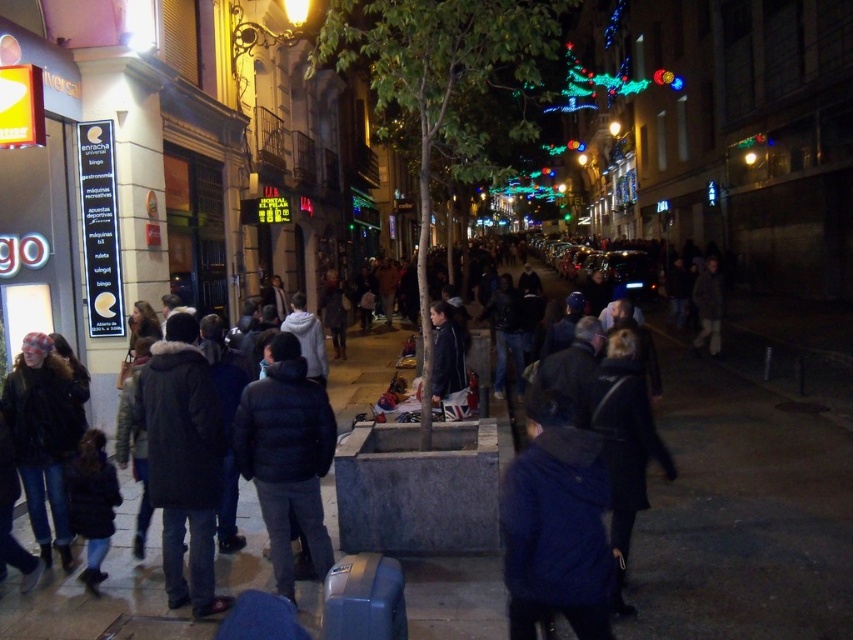
Which is below, concrete sidewalk at center or blue fuzzy jacket at center?

Positioned lower is blue fuzzy jacket at center.

Measure the distance from concrete sidewalk at center to blue fuzzy jacket at center.

8.94 feet

Consider the image. Who is more forward, [787,561] or [601,470]?

Point [601,470] is in front.

Locate an element on the screen. This screenshot has width=853, height=640. concrete sidewalk at center is located at coordinates (741, 515).

Does concrete sidewalk at center have a larger size compared to black puffy jacket at center?

Correct, concrete sidewalk at center is larger in size than black puffy jacket at center.

Is point (148, 596) positioned behind point (263, 380)?

Yes, it is.

Where is `concrete sidewalk at center`? Image resolution: width=853 pixels, height=640 pixels. concrete sidewalk at center is located at coordinates (741, 515).

Which is more to the left, blue fuzzy jacket at center or black puffy jacket at center?

From the viewer's perspective, black puffy jacket at center appears more on the left side.

In the scene shown: Between blue fuzzy jacket at center and black puffy jacket at center, which one has less height?

Standing shorter between the two is blue fuzzy jacket at center.

Describe the element at coordinates (556, 525) in the screenshot. The image size is (853, 640). I see `blue fuzzy jacket at center` at that location.

Find the location of a particular element. blue fuzzy jacket at center is located at coordinates (556, 525).